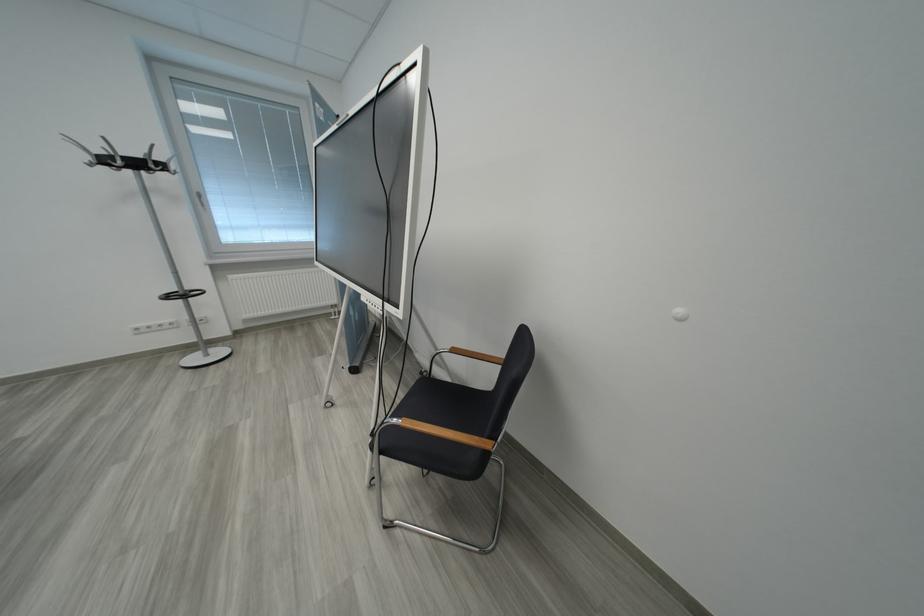
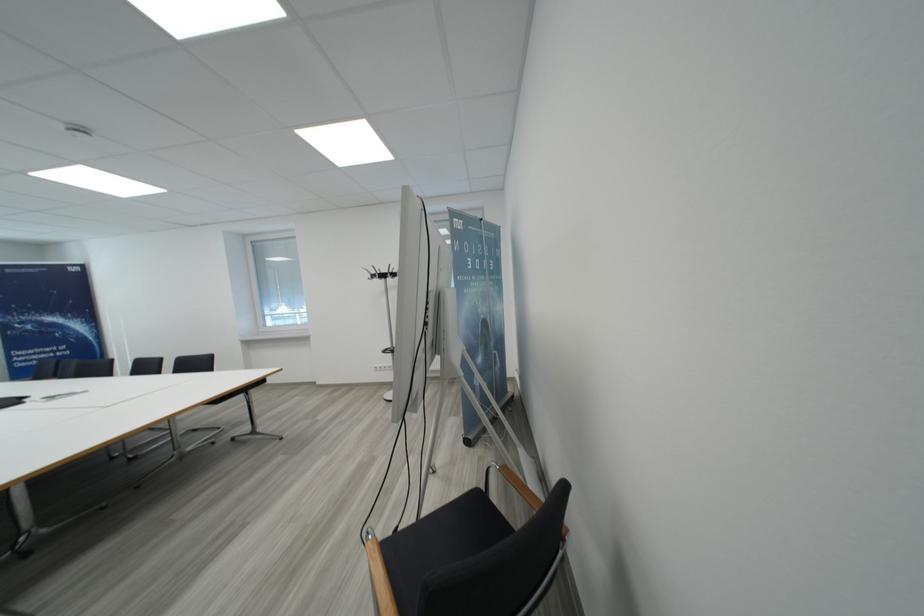
In the second image, find the point that corresponds to (144,167) in the first image.

(390, 278)